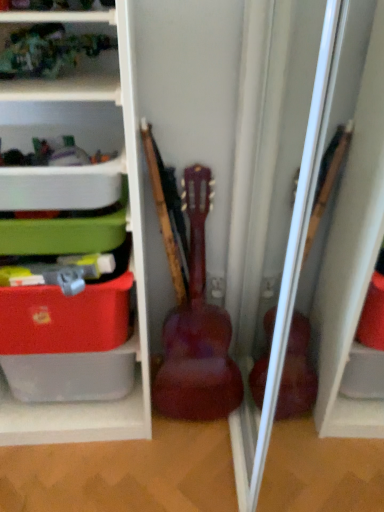
Locate an element on the screen. free space that is in between matte plastic storage at left, the 1th shelf positioned from the bottom, and glossy wood guitar at center is located at coordinates (179, 431).